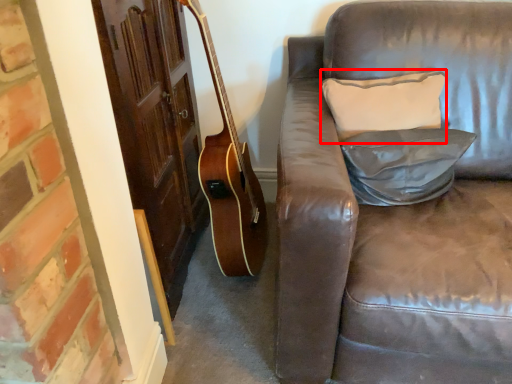
Question: From the image's perspective, where is pillow (annotated by the red box) located in relation to pillow in the image?

Choices:
 (A) above
 (B) below

Answer: (A)